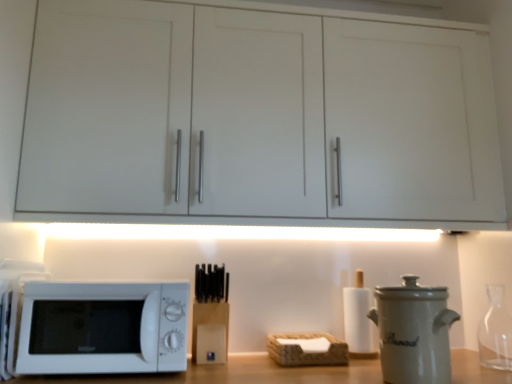
Question: Is white ceramic bread bin at right inside or outside of white matte paper towel at center-right, positioned as the first bottle in back-to-front order?

Choices:
 (A) inside
 (B) outside

Answer: (B)

Question: From a real-world perspective, relative to white matte paper towel at center-right, positioned as the first bottle in back-to-front order, is white ceramic bread bin at right vertically above or below?

Choices:
 (A) below
 (B) above

Answer: (A)

Question: Which is farther from the white matte paper towel at center-right, acting as the first bottle starting from the left?

Choices:
 (A) white matte microwave at lower left
 (B) white ceramic bread bin at right
 (C) transparent glass bottle at right, acting as the 1th bottle starting from the right
 (D) brown woven basket at center
 (E) white matte cabinet at upper center

Answer: (E)

Question: Which is nearer to the white matte microwave at lower left?

Choices:
 (A) transparent glass bottle at right, placed as the 1th bottle when sorted from front to back
 (B) white matte cabinet at upper center
 (C) brown woven basket at center
 (D) white ceramic bread bin at right
 (E) white matte paper towel at center-right, acting as the first bottle starting from the left

Answer: (B)